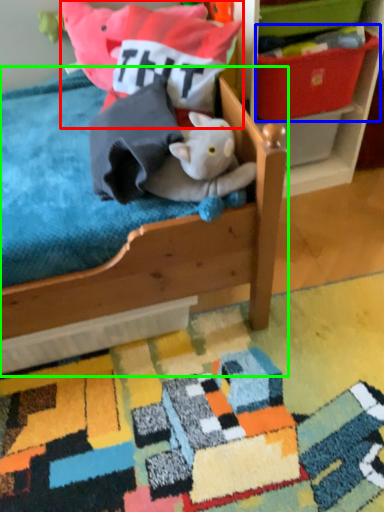
Question: Considering the real-world distances, which object is closest to pillow (highlighted by a red box)? storage box (highlighted by a blue box) or furniture (highlighted by a green box).

Choices:
 (A) storage box
 (B) furniture

Answer: (A)